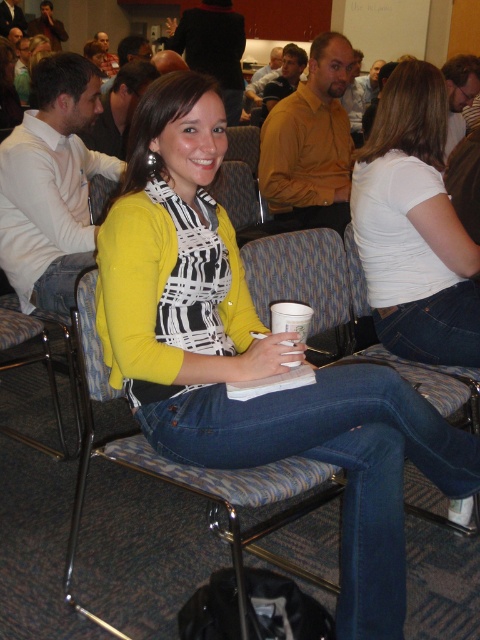
You are standing in the conference room and notice a point marked at coordinates (415, 227). What object is located at that position?

The point at coordinates (415, 227) corresponds to the white matte shirt at center.

You are standing in the conference room and need to locate the yellow matte cardigan at center. According to the coordinates provided, where exactly is it positioned in the room?

The yellow matte cardigan at center is positioned at the 2D coordinates point (x=252, y=356) in the room.